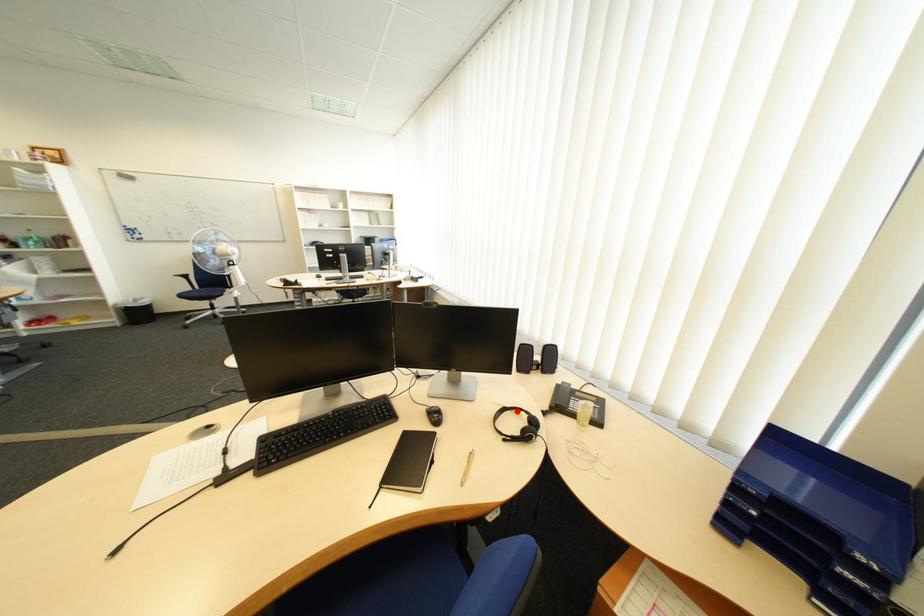
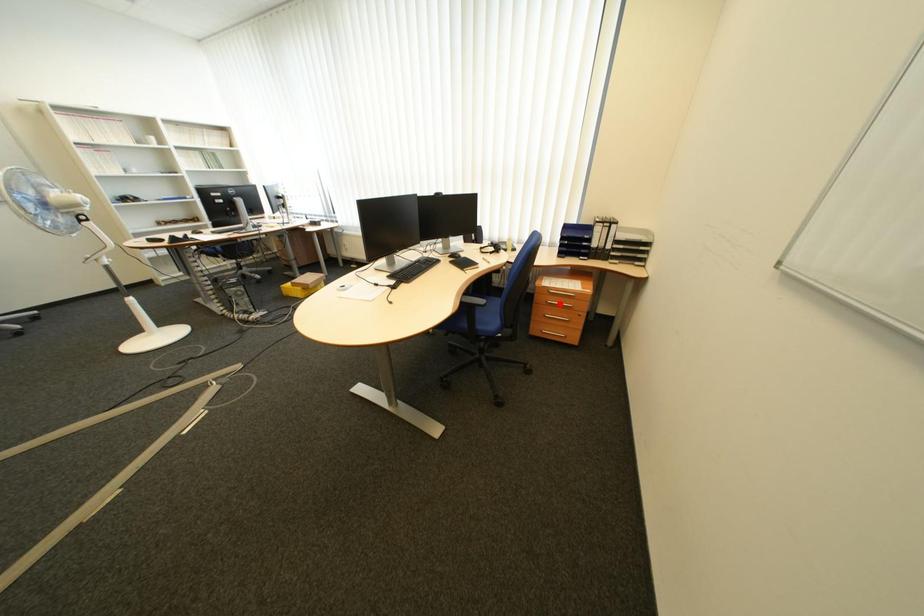
I am providing you with two images of the same scene from different viewpoints. A red point is marked on the first image and another point is marked on the second image. Are the points marked in image1 and image2 representing the same 3D position?

No